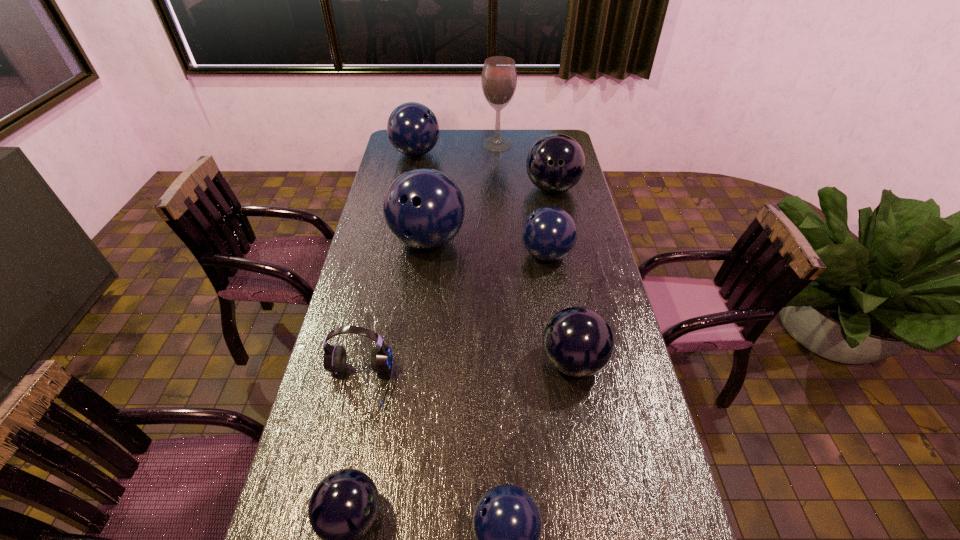
Identify the location of free space located on the side of the fifth farthest bowling ball with the finger holes. (505, 362).

Identify the location of vacant position located 0.350m on the side of the fifth farthest bowling ball with the finger holes. Image resolution: width=960 pixels, height=540 pixels. (419, 362).

What are the coordinates of `vacant space located on the ear cushions of the headset` in the screenshot? It's located at (344, 449).

Identify the location of alcohol that is positioned at the far edge. This screenshot has height=540, width=960. (499, 77).

This screenshot has height=540, width=960. I want to click on bowling ball that is at the far edge, so click(413, 129).

Locate an element on the screen. headset located at the left edge is located at coordinates (335, 356).

This screenshot has width=960, height=540. In order to click on object that is at the far left corner in this screenshot , I will do `click(413, 129)`.

The height and width of the screenshot is (540, 960). What are the coordinates of `free point at the far edge` in the screenshot? It's located at (514, 134).

Where is `free region at the left edge`? The height and width of the screenshot is (540, 960). free region at the left edge is located at coordinates (394, 252).

Where is `vacant space at the right edge of the desktop`? This screenshot has height=540, width=960. vacant space at the right edge of the desktop is located at coordinates (608, 411).